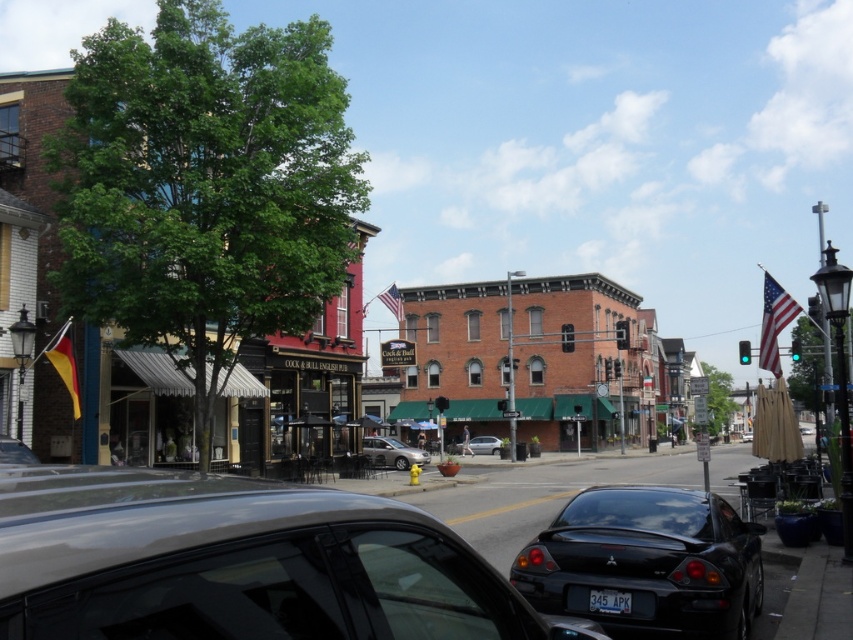
Question: Which object appears farthest from the camera in this image?

Choices:
 (A) black asphalt at center
 (B) satin silver sedan at center
 (C) shiny gray car at center

Answer: (B)

Question: Is black asphalt at center positioned behind silver metallic sedan at center?

Choices:
 (A) yes
 (B) no

Answer: (B)

Question: Does glossy black car at center have a greater width compared to black asphalt at center?

Choices:
 (A) yes
 (B) no

Answer: (B)

Question: Which point is closer to the camera taking this photo?

Choices:
 (A) (273, 438)
 (B) (460, 444)
 (C) (607, 593)
 (D) (781, 589)

Answer: (C)

Question: Can you confirm if shiny gray car at center is positioned above satin silver sedan at center?

Choices:
 (A) no
 (B) yes

Answer: (B)

Question: Which object is farther from the camera taking this photo?

Choices:
 (A) glossy black car at center
 (B) silver metallic sedan at center
 (C) brick building at center

Answer: (B)